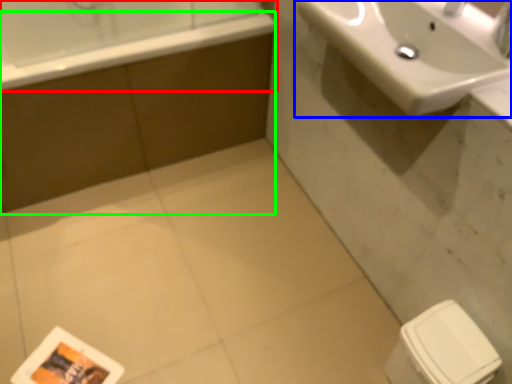
Question: Which object is positioned farthest from bathtub (highlighted by a red box)? Select from sink (highlighted by a blue box) and bath (highlighted by a green box).

Choices:
 (A) sink
 (B) bath

Answer: (A)